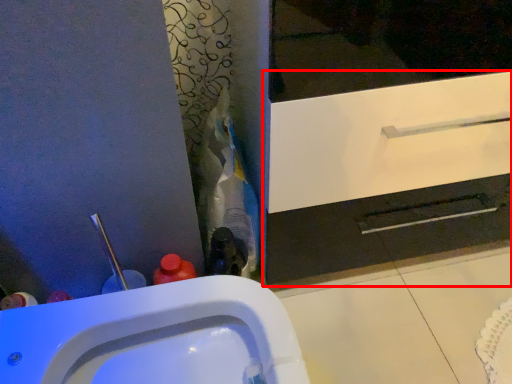
Question: From the image's perspective, where is bathroom cabinet (annotated by the red box) located relative to sink?

Choices:
 (A) above
 (B) below

Answer: (A)